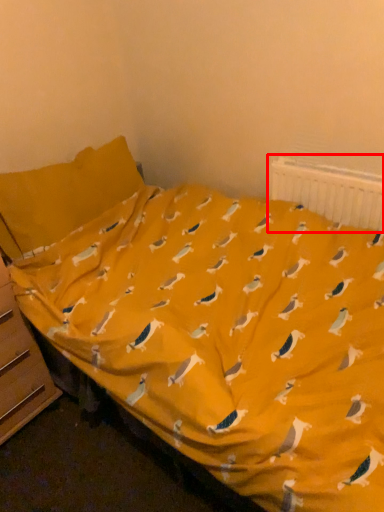
Question: From the image's perspective, what is the correct spatial positioning of radiator (annotated by the red box) in reference to file cabinet?

Choices:
 (A) above
 (B) below

Answer: (A)